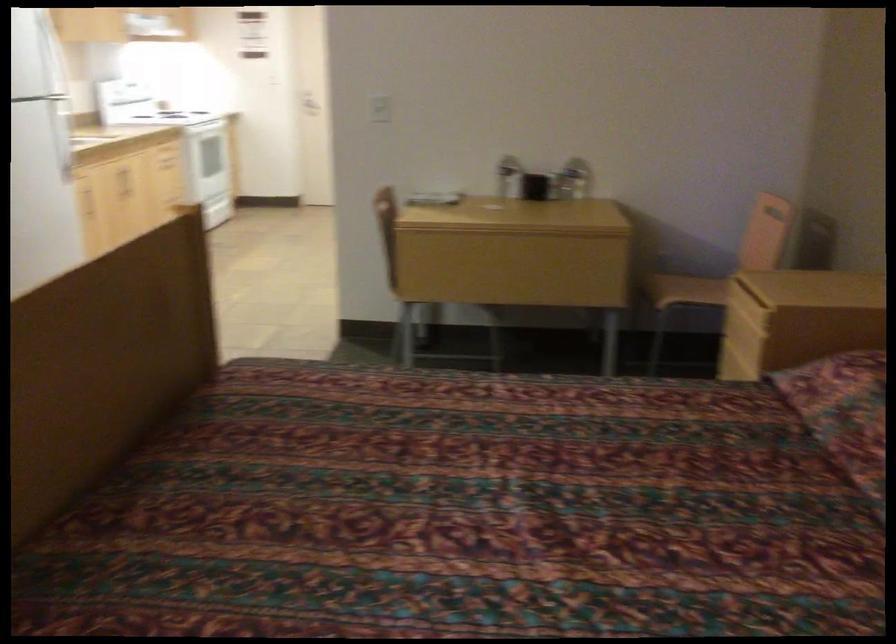
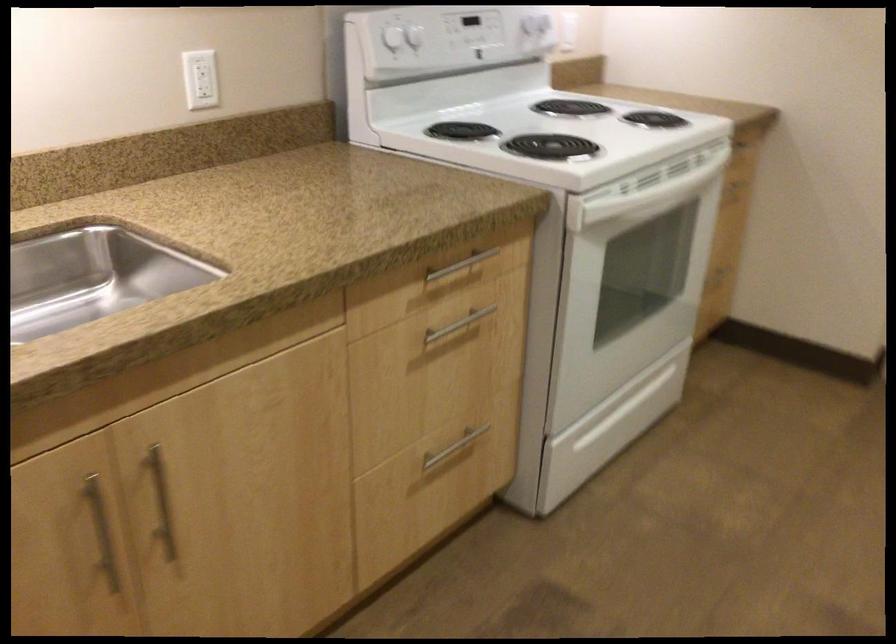
In the second image, find the point that corresponds to (184,193) in the first image.

(453, 448)